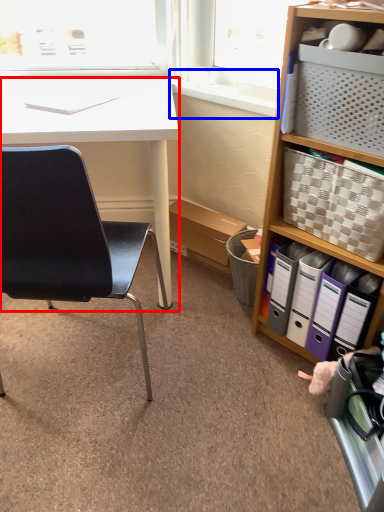
Question: Which of the following is the farthest to the observer, desk (highlighted by a red box) or window sill (highlighted by a blue box)?

Choices:
 (A) desk
 (B) window sill

Answer: (B)